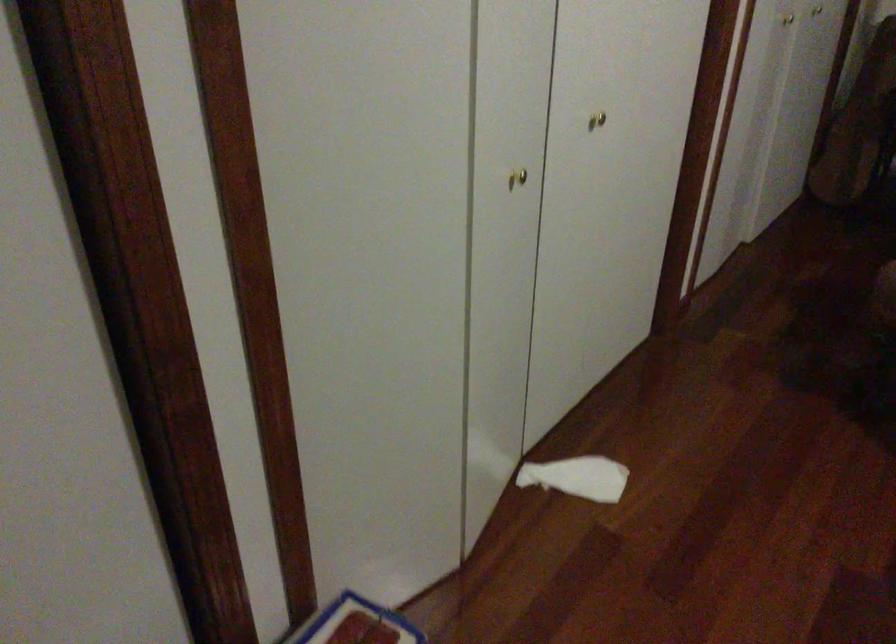
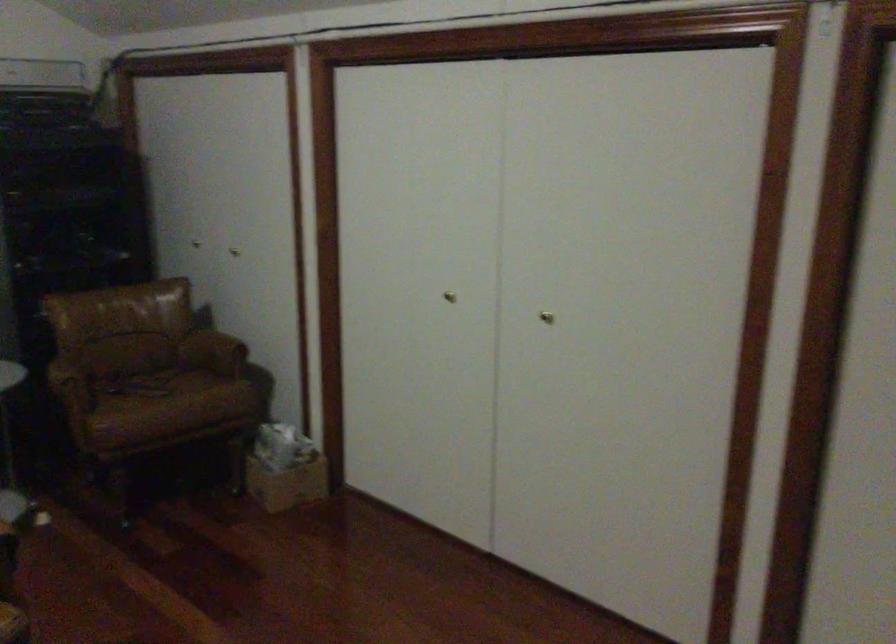
Question: The first image is from the beginning of the video and the second image is from the end. How did the camera likely rotate when shooting the video?

Choices:
 (A) Left
 (B) Right
 (C) Up
 (D) Down

Answer: (B)